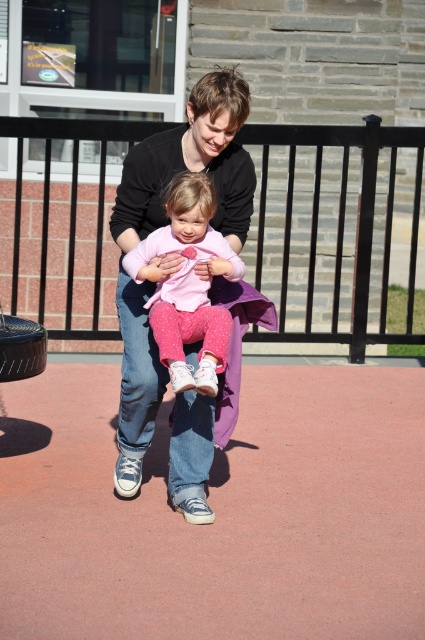
Who is taller, matte black shirt at center or pink polka dot pants at center?

matte black shirt at center

Does point (187, 413) come closer to viewer compared to point (184, 321)?

No.

Locate an element on the screen. matte black shirt at center is located at coordinates (164, 225).

Does black metal fence at upper center appear on the right side of pink polka dot pants at center?

Correct, you'll find black metal fence at upper center to the right of pink polka dot pants at center.

What do you see at coordinates (331, 228) in the screenshot?
I see `black metal fence at upper center` at bounding box center [331, 228].

Identify the location of black metal fence at upper center. (331, 228).

Who is more distant from viewer, [385,134] or [138,228]?

The point [385,134] is more distant.

Looking at this image, between black metal fence at upper center and matte black shirt at center, which one is positioned higher?

Positioned higher is matte black shirt at center.

Which is behind, point (88, 186) or point (139, 337)?

Positioned behind is point (88, 186).

Where is `black metal fence at upper center`? The height and width of the screenshot is (640, 425). black metal fence at upper center is located at coordinates (331, 228).